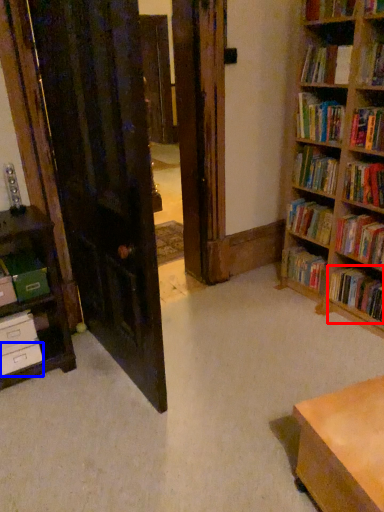
Question: Which of the following is the farthest to the observer, book (highlighted by a red box) or drawer (highlighted by a blue box)?

Choices:
 (A) book
 (B) drawer

Answer: (A)